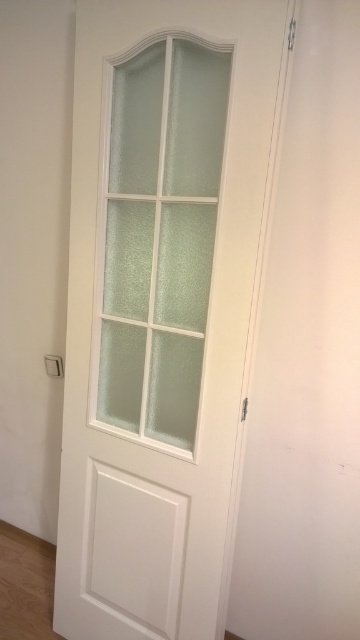
Is white matte door at center taller than frosted glass door at center?

Yes, white matte door at center is taller than frosted glass door at center.

Who is taller, white matte door at center or frosted glass door at center?

white matte door at center is taller.

Which is in front, point (128, 604) or point (131, 246)?

Point (131, 246)

Where is `white matte door at center`? The image size is (360, 640). white matte door at center is located at coordinates (162, 305).